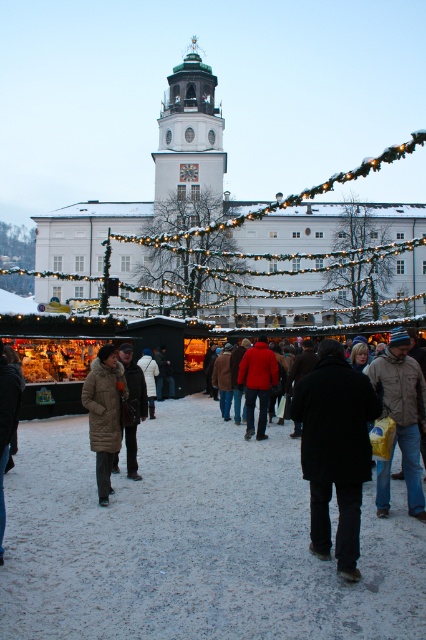
You are a photographer at the Christmas market and want to capture both the brown fur coat at lower left and the white fur coat at center in a single frame. Which coat should you position closer to the left edge of your camera viewfinder to ensure both are visible?

The brown fur coat at lower left is already positioned on the left side of the white fur coat at center, so you should keep the brown fur coat at lower left near the left edge of the viewfinder to include both in the frame.

You are a photographer at the Christmas market and want to capture both the brown wool coat at center and the white fur coat at center in a single photo. Since you want to highlight the coats, you need to ensure they are both fully visible. Based on their positions, which coat should you focus on first to make sure both are in frame?

The brown wool coat at center is located below the white fur coat at center, so you should focus on the white fur coat at center first to ensure both are in frame.

You are a shopper at the Christmas market and want to try on two coats displayed at the center. The coats are the black matte coat at center and the brown wool coat at center. Which coat should you approach first if you want to reach the one on the left first?

The brown wool coat at center is on the left, so you should approach it first.